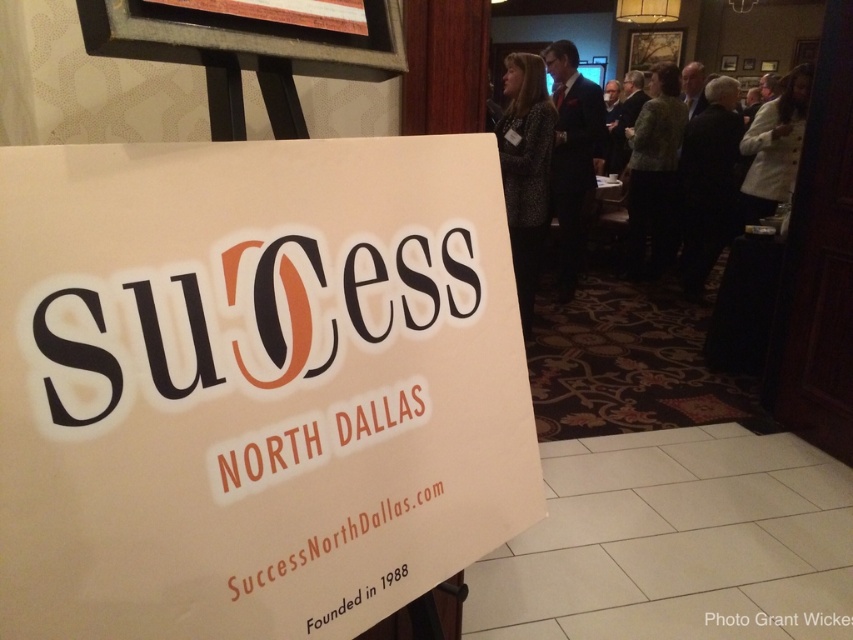
Question: Is black suit at right closer to the viewer compared to green textured blazer at center?

Choices:
 (A) no
 (B) yes

Answer: (B)

Question: Which of the following is the closest to the observer?

Choices:
 (A) (641, 180)
 (B) (695, 205)
 (C) (140, 426)

Answer: (C)

Question: Is patterned fabric jacket at upper right bigger than black suit at right?

Choices:
 (A) no
 (B) yes

Answer: (A)

Question: Does dark suit at upper right appear on the left side of white fuzzy coat at upper right?

Choices:
 (A) no
 (B) yes

Answer: (B)

Question: Which object is farther from the camera taking this photo?

Choices:
 (A) black suit at right
 (B) patterned fabric jacket at upper right
 (C) white paper sign at center

Answer: (A)

Question: Which object is positioned closest to the green textured blazer at center?

Choices:
 (A) patterned fabric jacket at upper right
 (B) black suit at right
 (C) white paper sign at center
 (D) white fuzzy coat at upper right

Answer: (B)